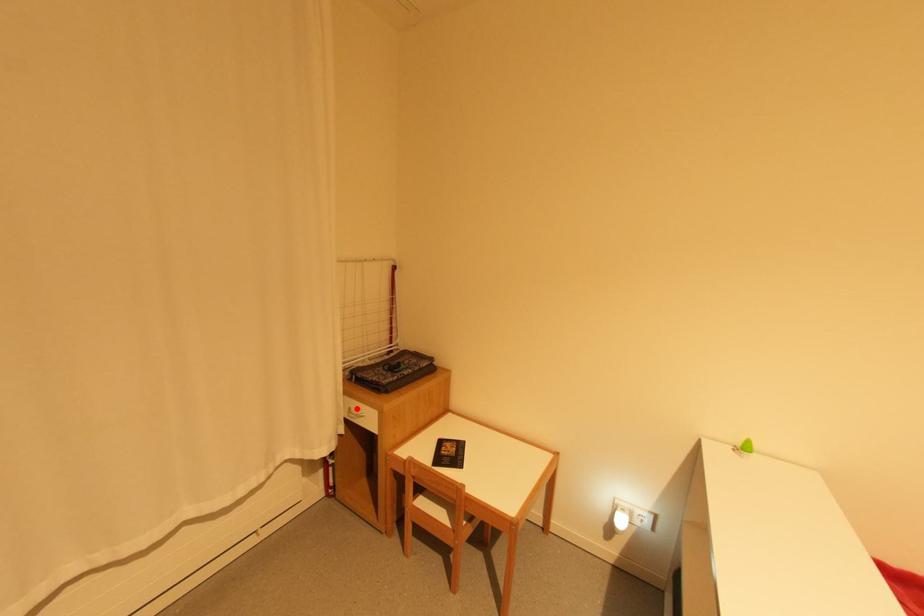
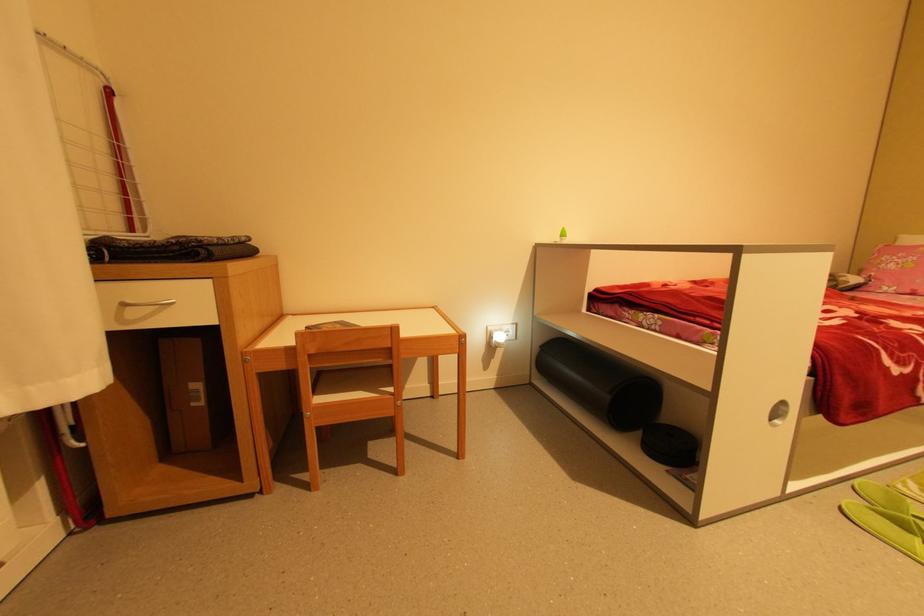
Question: I am providing you with two images of the same scene from different viewpoints. Image1 has a red point marked. In image2, the corresponding 3D location appears at what relative position? Reply with the corresponding letter.

Choices:
 (A) Closer
 (B) Farther

Answer: (A)